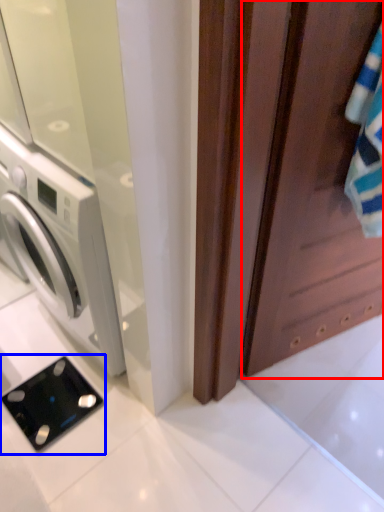
Question: Among these objects, which one is nearest to the camera, screen door (highlighted by a red box) or appliance (highlighted by a blue box)?

Choices:
 (A) screen door
 (B) appliance

Answer: (A)